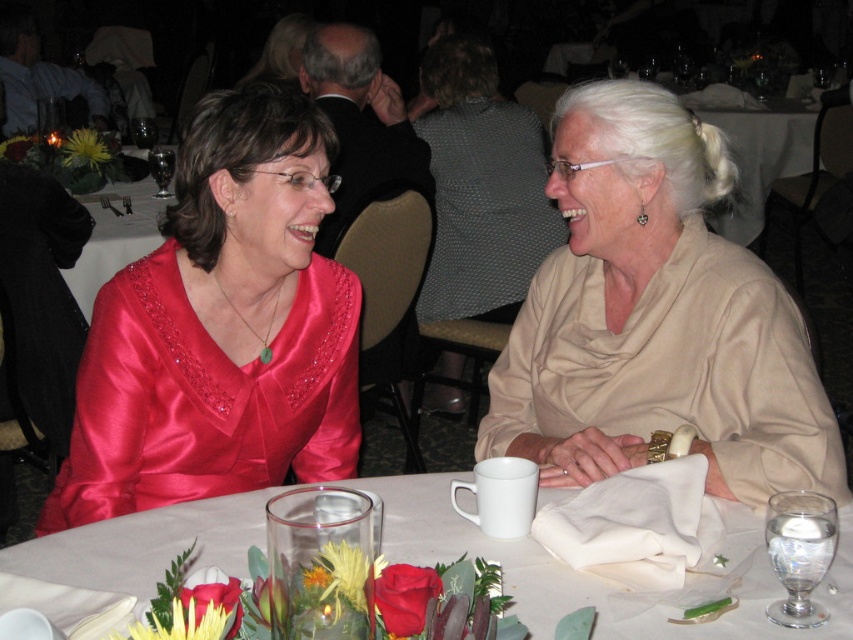
Question: Can you confirm if beige satin blouse at right is positioned below white matte napkin at lower center?

Choices:
 (A) no
 (B) yes

Answer: (A)

Question: Which point is closer to the camera?

Choices:
 (A) beige satin blouse at right
 (B) satin dress at left

Answer: (A)

Question: Is beige satin blouse at right to the left of white matte napkin at lower center from the viewer's perspective?

Choices:
 (A) yes
 (B) no

Answer: (B)

Question: Is beige satin blouse at right to the right of white matte napkin at lower center from the viewer's perspective?

Choices:
 (A) no
 (B) yes

Answer: (B)

Question: Which of the following is the farthest from the observer?

Choices:
 (A) beige satin blouse at right
 (B) satin dress at left

Answer: (B)

Question: Among these points, which one is farthest from the camera?

Choices:
 (A) (764, 596)
 (B) (190, 467)

Answer: (B)